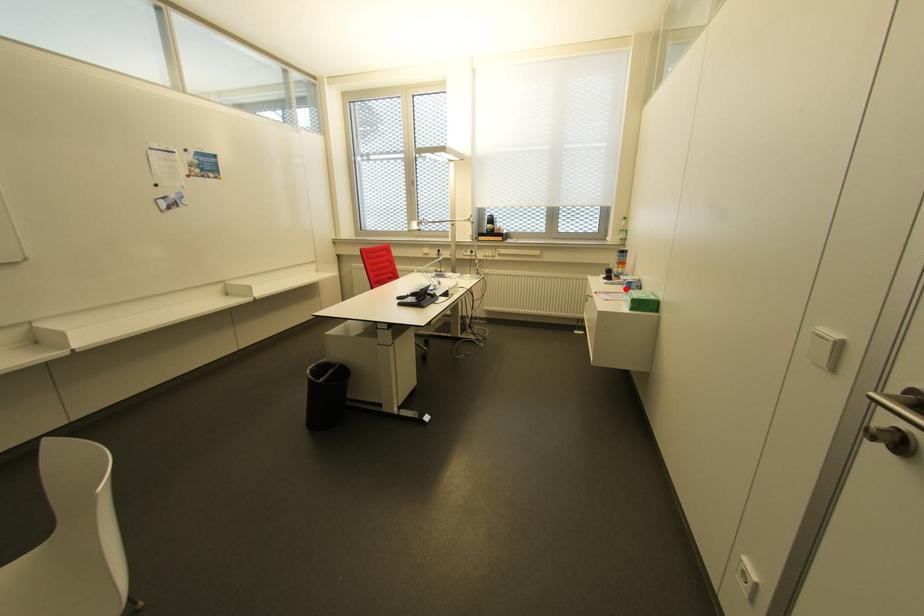
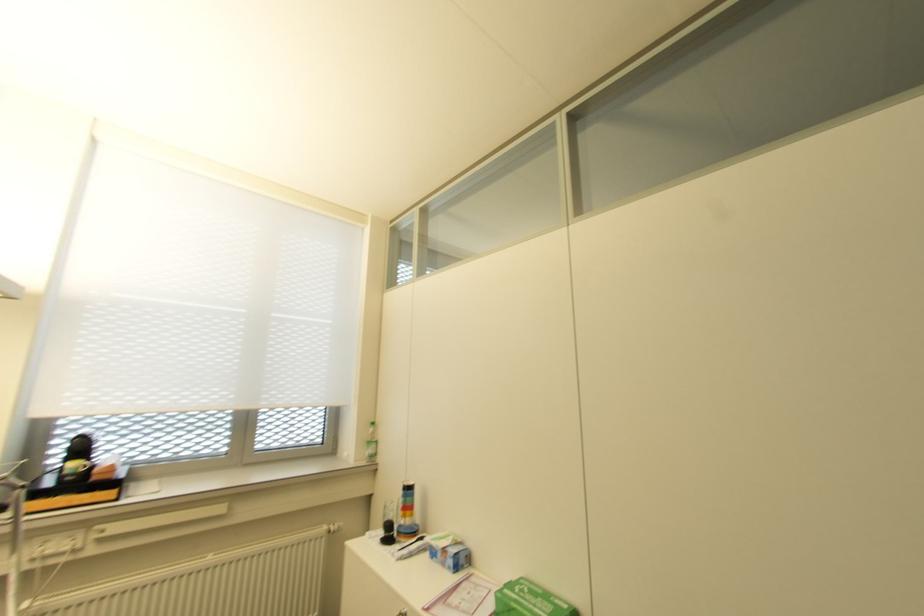
The point at the highlighted location is marked in the first image. Where is the corresponding point in the second image?

(454, 568)